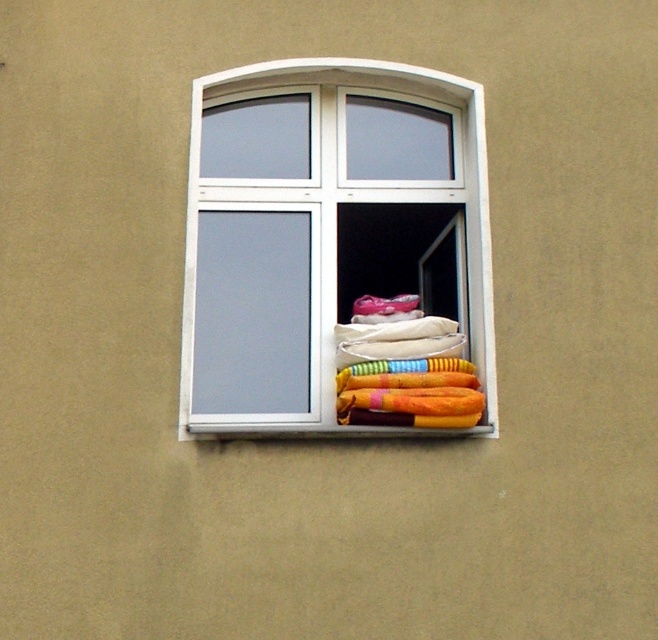
Between white plastic window at center and multicolored fabric at center, which one has less height?

multicolored fabric at center

Who is positioned more to the right, white plastic window at center or multicolored fabric at center?

multicolored fabric at center is more to the right.

Between point (340, 161) and point (442, 369), which one is positioned in front?

Point (442, 369) is in front.

At what (x,y) coordinates should I click in order to perform the action: click on white plastic window at center. Please return your answer as a coordinate pair (x, y). The width and height of the screenshot is (658, 640). Looking at the image, I should click on (311, 227).